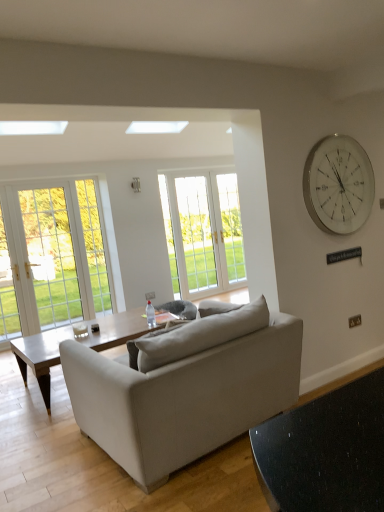
Question: Is light brown wooden coffee table at center at the left side of white glass clock at upper right?

Choices:
 (A) no
 (B) yes

Answer: (B)

Question: Does light brown wooden coffee table at center lie behind white glass clock at upper right?

Choices:
 (A) no
 (B) yes

Answer: (B)

Question: Is light brown wooden coffee table at center far from white glass clock at upper right?

Choices:
 (A) yes
 (B) no

Answer: (A)

Question: From a real-world perspective, is light brown wooden coffee table at center under white glass clock at upper right?

Choices:
 (A) no
 (B) yes

Answer: (B)

Question: From the image's perspective, is light brown wooden coffee table at center under white glass clock at upper right?

Choices:
 (A) no
 (B) yes

Answer: (B)

Question: From the image's perspective, is light brown wooden coffee table at center over white glass clock at upper right?

Choices:
 (A) no
 (B) yes

Answer: (A)

Question: Is light brown wooden coffee table at center at the back of white plastic power outlet at center?

Choices:
 (A) no
 (B) yes

Answer: (A)

Question: Considering the relative sizes of white plastic power outlet at center and light brown wooden coffee table at center in the image provided, is white plastic power outlet at center shorter than light brown wooden coffee table at center?

Choices:
 (A) yes
 (B) no

Answer: (A)

Question: Is white plastic power outlet at center at the right side of light brown wooden coffee table at center?

Choices:
 (A) no
 (B) yes

Answer: (B)

Question: Considering the relative sizes of white plastic power outlet at center and light brown wooden coffee table at center in the image provided, is white plastic power outlet at center smaller than light brown wooden coffee table at center?

Choices:
 (A) yes
 (B) no

Answer: (A)

Question: Can you confirm if white plastic power outlet at center is wider than light brown wooden coffee table at center?

Choices:
 (A) yes
 (B) no

Answer: (B)

Question: Would you say white plastic power outlet at center is outside light brown wooden coffee table at center?

Choices:
 (A) yes
 (B) no

Answer: (A)

Question: Is white glass window at center further to camera compared to white plastic power outlet at center?

Choices:
 (A) no
 (B) yes

Answer: (B)